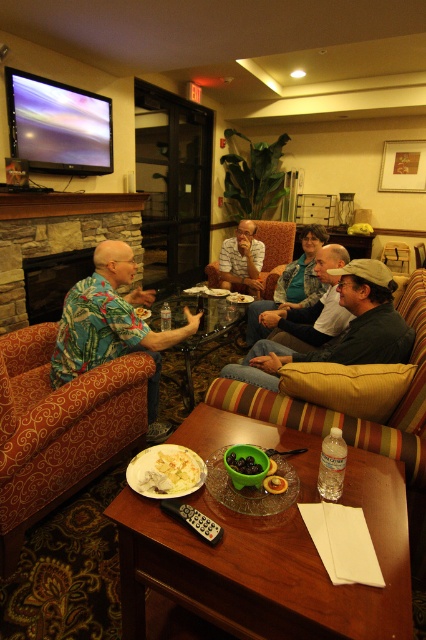
Who is positioned more to the left, blue floral shirt at center or smooth green bowl at center?

Positioned to the left is smooth green bowl at center.

Image resolution: width=426 pixels, height=640 pixels. Describe the element at coordinates (310, 308) in the screenshot. I see `blue floral shirt at center` at that location.

Locate an element on the screen. This screenshot has width=426, height=640. blue floral shirt at center is located at coordinates (310, 308).

Which is more to the left, striped fabric couch at center or smooth plastic remote at center?

smooth plastic remote at center

Describe the element at coordinates (397, 436) in the screenshot. I see `striped fabric couch at center` at that location.

Locate an element on the screen. The image size is (426, 640). striped fabric couch at center is located at coordinates (397, 436).

Is point (207, 541) in front of point (273, 460)?

Yes, point (207, 541) is closer to viewer.

Which is in front, point (172, 500) or point (270, 465)?

Point (172, 500) is in front.

Where is `black plastic remote at lower center`? This screenshot has width=426, height=640. black plastic remote at lower center is located at coordinates (192, 518).

The height and width of the screenshot is (640, 426). I want to click on black plastic remote at lower center, so click(192, 518).